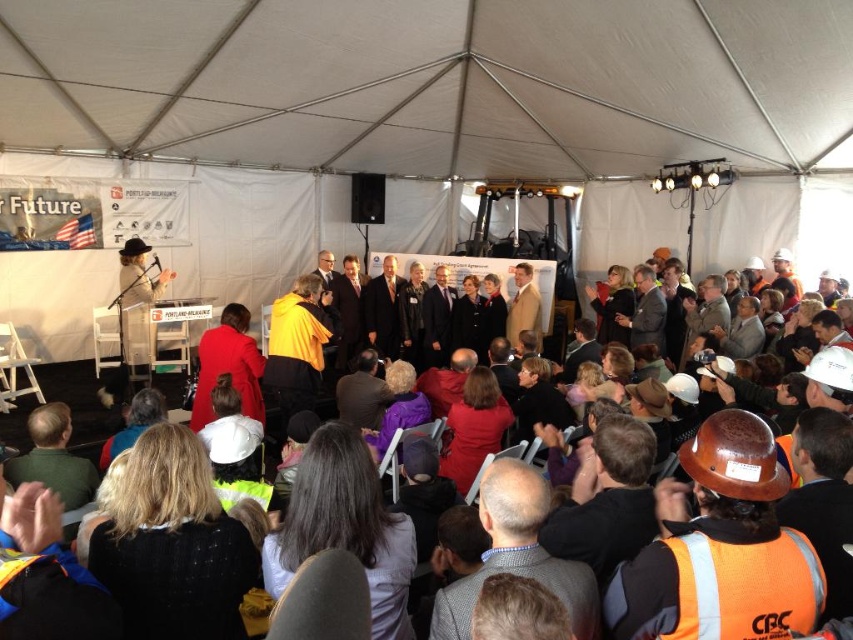
Question: Based on their relative distances, which object is nearer to the red fabric coat at center?

Choices:
 (A) hard hat at left
 (B) black knit sweater at lower left
 (C) orange safety vest at center
 (D) matte black suit at center

Answer: (B)

Question: Which of the following is the farthest from the observer?

Choices:
 (A) hard hat at left
 (B) red fabric coat at center
 (C) orange safety vest at lower right

Answer: (A)

Question: Can you confirm if yellow fabric at center is thinner than matte black suit at center?

Choices:
 (A) no
 (B) yes

Answer: (B)

Question: Which point is closer to the camera taking this photo?

Choices:
 (A) (634, 314)
 (B) (144, 488)

Answer: (B)

Question: Can you confirm if green fabric jacket at lower left is bigger than beige wool coat at center?

Choices:
 (A) yes
 (B) no

Answer: (B)

Question: In this image, where is black knit sweater at lower left located relative to beige wool coat at center?

Choices:
 (A) left
 (B) right

Answer: (A)